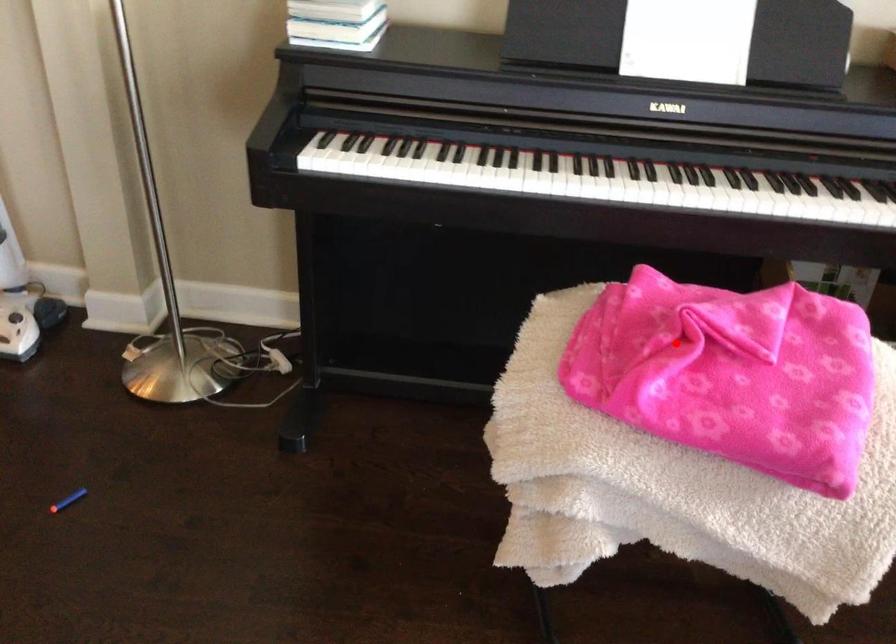
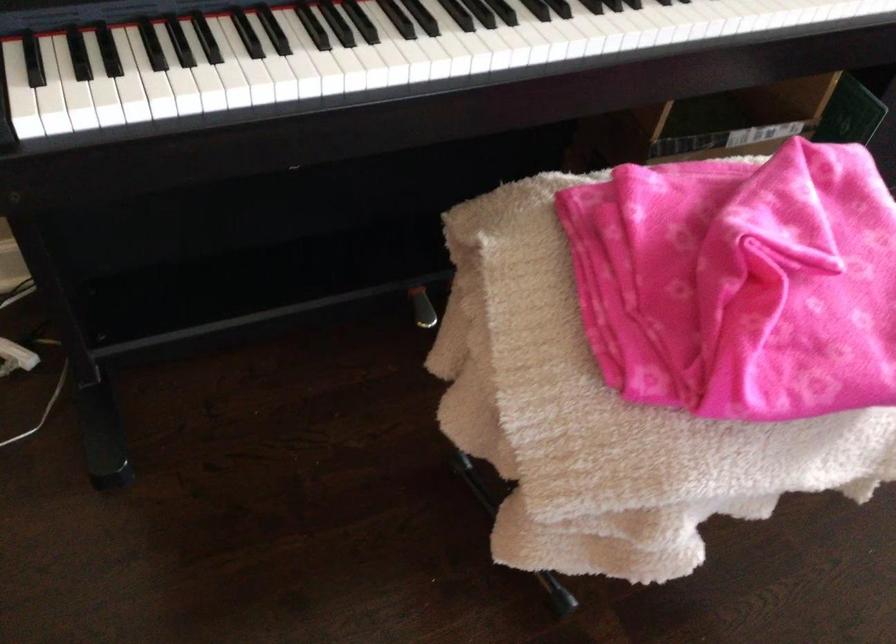
Question: I am providing you with two images of the same scene from different viewpoints. A red point is marked on the first image. Is the red point's position out of view in image 2?

Choices:
 (A) Yes
 (B) No

Answer: (B)